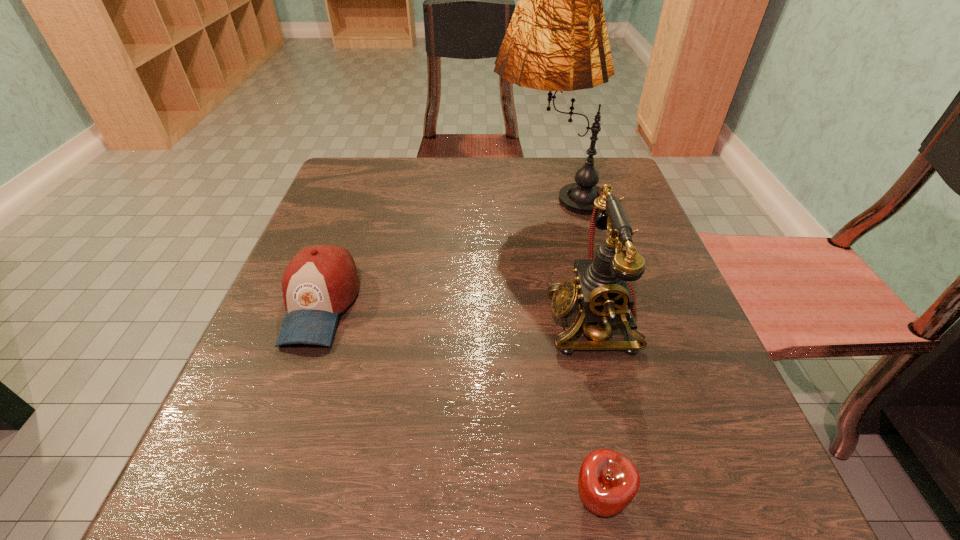
Image resolution: width=960 pixels, height=540 pixels. What are the coordinates of `blank space located on the front of the second tallest object, featuring the rotary dial` in the screenshot? It's located at pos(345,320).

Identify the location of free space located on the front-facing side of the leftmost object. (262, 463).

Identify the location of free spot located on the left of the apple. (264, 500).

Where is `object that is at the far edge`? The height and width of the screenshot is (540, 960). object that is at the far edge is located at coordinates (557, 40).

You are a GUI agent. You are given a task and a screenshot of the screen. Output one action in this format:
    pyautogui.click(x=<x>, y=<y>)
    Task: Click on the object that is at the near edge
    This screenshot has width=960, height=540.
    Given the screenshot: What is the action you would take?
    pyautogui.click(x=608, y=481)

I want to click on object that is at the left edge, so click(321, 281).

At what (x,y) coordinates should I click in order to perform the action: click on lampshade present at the right edge. Please return your answer as a coordinate pair (x, y). The height and width of the screenshot is (540, 960). Looking at the image, I should click on (557, 40).

In order to click on telephone situated at the right edge in this screenshot , I will do `click(600, 290)`.

Find the location of `object that is at the far right corner`. object that is at the far right corner is located at coordinates (557, 40).

The width and height of the screenshot is (960, 540). What are the coordinates of `blank area at the far edge` in the screenshot? It's located at (403, 173).